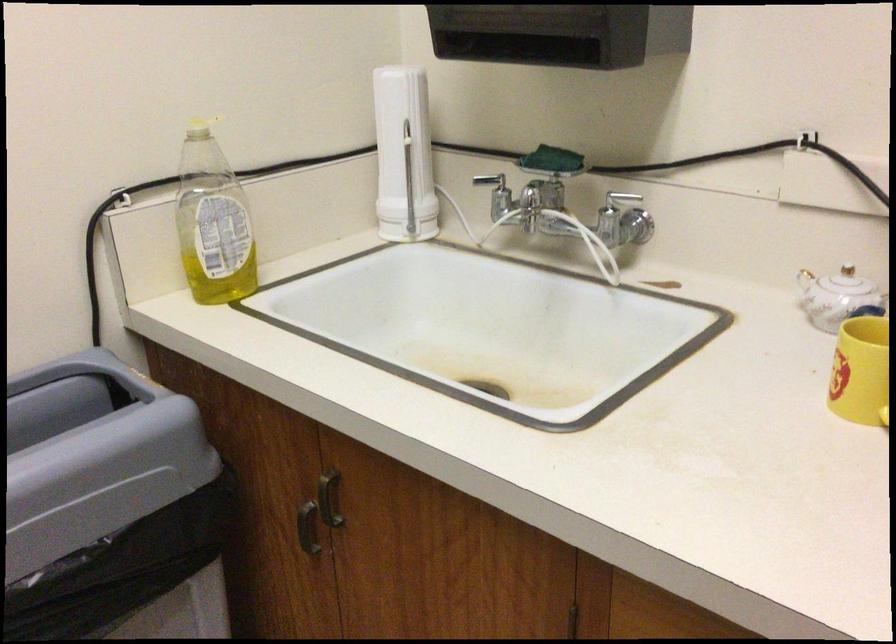
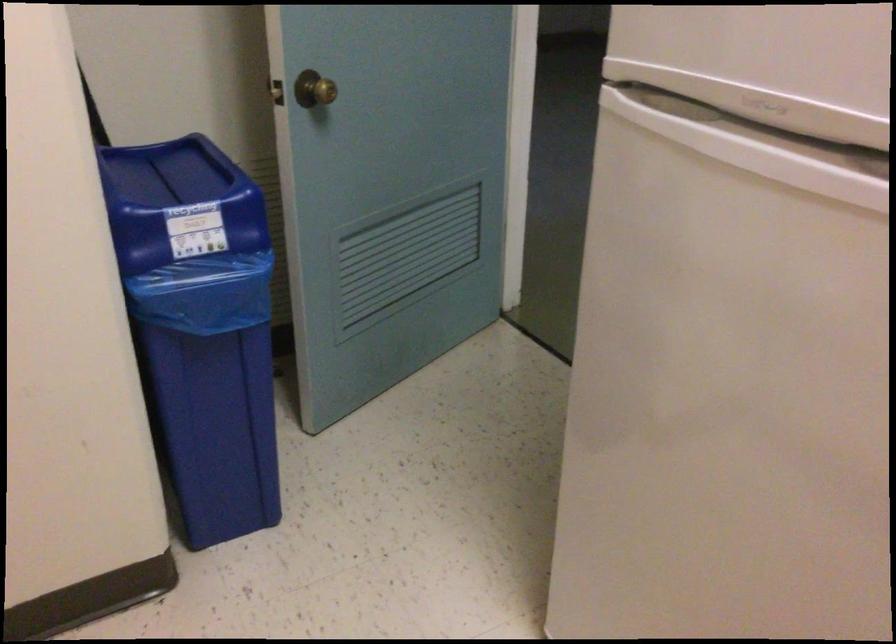
The first image is from the beginning of the video and the second image is from the end. How did the camera likely rotate when shooting the video?

The camera's rotation is toward left-down.